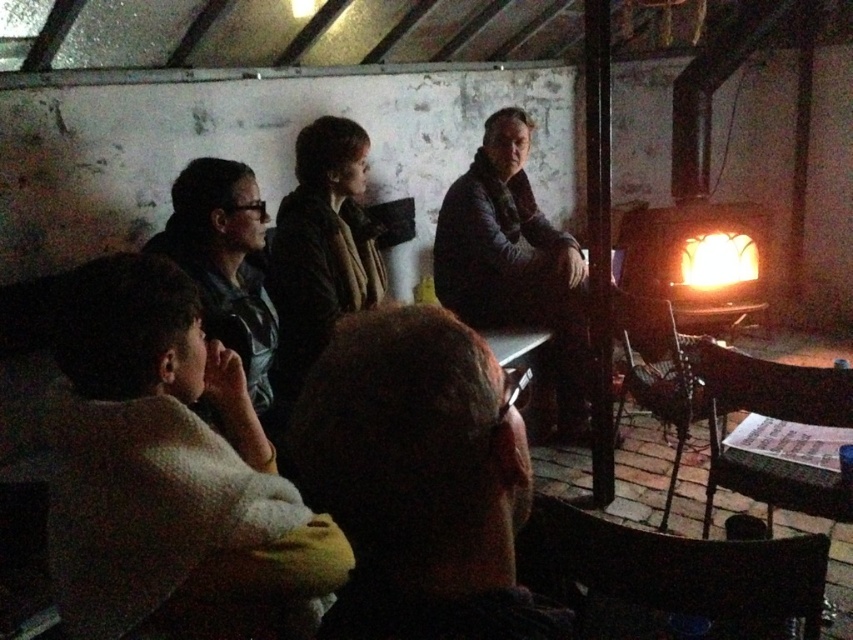
Question: Is dark blue leather jacket at center closer to the viewer compared to matte black jacket at left?

Choices:
 (A) yes
 (B) no

Answer: (B)

Question: Can you confirm if dark blue leather jacket at center is thinner than matte black jacket at left?

Choices:
 (A) no
 (B) yes

Answer: (A)

Question: Among these points, which one is farthest from the camera?

Choices:
 (A) (474, 312)
 (B) (238, 305)
 (C) (317, 388)

Answer: (A)

Question: Which object appears closest to the camera in this image?

Choices:
 (A) matte black jacket at left
 (B) brown hair at center
 (C) dark blue leather jacket at center

Answer: (B)

Question: Does dark blue leather jacket at center have a greater width compared to matte black jacket at left?

Choices:
 (A) no
 (B) yes

Answer: (B)

Question: Which is nearer to the dark blue leather jacket at center?

Choices:
 (A) matte black jacket at left
 (B) brown hair at center

Answer: (A)